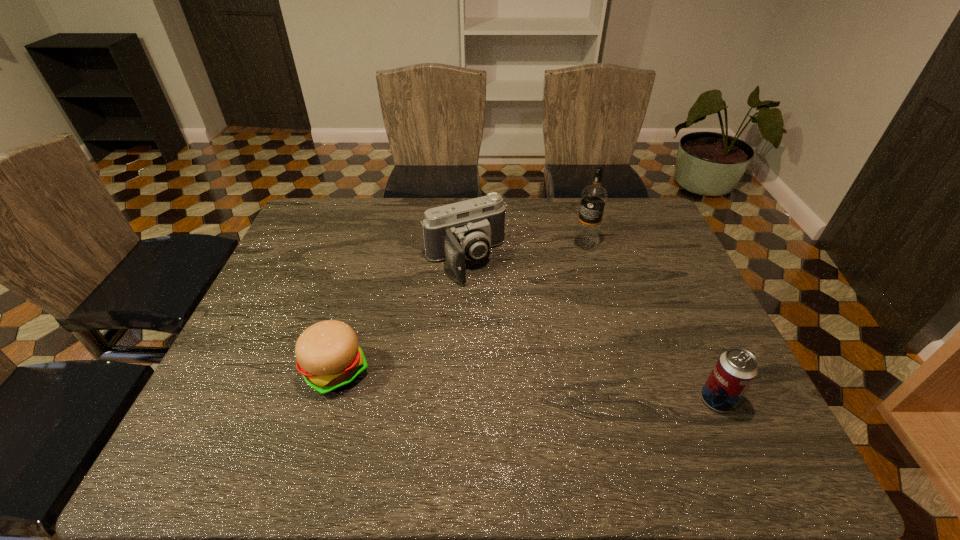
Identify the location of vacant space that satisfies the following two spatial constraints: 1. on the front side of the beer can; 2. on the right side of the camera. Image resolution: width=960 pixels, height=540 pixels. (460, 400).